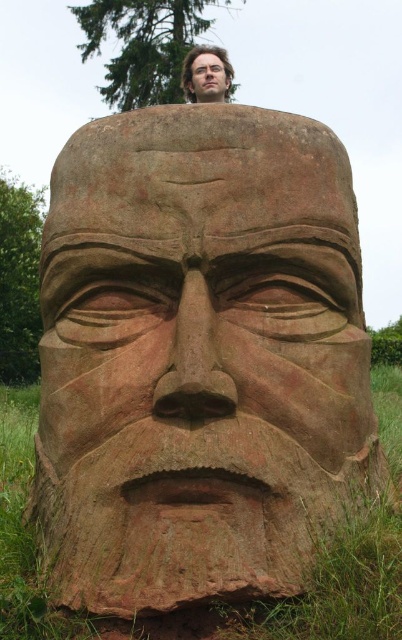
You are an art student analyzing the sculpture from a distance. You notice two parts of the sculpture labeled as the smooth brown wooden head at upper center and the smooth wood face at upper center. Which part appears closer to you?

The smooth brown wooden head at upper center appears closer to you because it is further to the viewer than the smooth wood face at upper center.

You are an artist planning to create a miniature version of the sculpture. You need to know which object is narrower to scale it down accurately. Which one is narrower between the smooth brown wooden head at upper center and the smooth wood face at upper center?

The smooth brown wooden head at upper center is narrower than the smooth wood face at upper center.